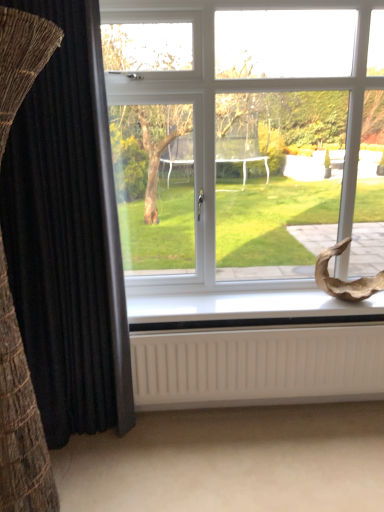
Describe the element at coordinates (65, 239) in the screenshot. I see `black velvet curtain at left` at that location.

Find the location of `white plastic window at center`. white plastic window at center is located at coordinates (246, 152).

From the image's perspective, is black velvet curtain at left beneath white matte radiator at bottom?

Actually, black velvet curtain at left appears above white matte radiator at bottom in the image.

The image size is (384, 512). I want to click on curtain above the white matte radiator at bottom (from the image's perspective), so click(65, 239).

Can you confirm if black velvet curtain at left is shorter than white matte radiator at bottom?

In fact, black velvet curtain at left may be taller than white matte radiator at bottom.

Is black velvet curtain at left oriented away from white matte radiator at bottom?

No.

Choose the correct answer: Is white matte radiator at bottom inside white plastic window at center or outside it?

Result: white matte radiator at bottom is located beyond the bounds of white plastic window at center.

Between point (335, 335) and point (214, 298), which one is positioned in front?

The point (335, 335) is more forward.

Can you tell me how much white matte radiator at bottom and white plastic window at center differ in facing direction?

The angle between the facing direction of white matte radiator at bottom and the facing direction of white plastic window at center is 0.0586 degrees.

From a real-world perspective, is white matte radiator at bottom below white plastic window at center?

Correct, in the physical world, white matte radiator at bottom is lower than white plastic window at center.

From the image's perspective, would you say white plastic window sill at lower center is shown under white matte radiator at bottom?

No.

From a real-world perspective, which is physically below, white plastic window sill at lower center or white matte radiator at bottom?

In real-world perspective, white matte radiator at bottom is lower.

Is white plastic window sill at lower center in front of or behind white matte radiator at bottom in the image?

Clearly, white plastic window sill at lower center is behind white matte radiator at bottom.

Is white plastic window sill at lower center oriented towards white matte radiator at bottom?

No, white plastic window sill at lower center is not aimed at white matte radiator at bottom.

How different are the orientations of white plastic window sill at lower center and black velvet curtain at left in degrees?

0.00334 degrees.

Does white plastic window sill at lower center have a lesser width compared to black velvet curtain at left?

Incorrect, the width of white plastic window sill at lower center is not less than that of black velvet curtain at left.

Are white plastic window sill at lower center and black velvet curtain at left making contact?

No, white plastic window sill at lower center is not making contact with black velvet curtain at left.

Where is `window sill on the right of black velvet curtain at left`? window sill on the right of black velvet curtain at left is located at coordinates (247, 310).

Is white matte radiator at bottom oriented towards black velvet curtain at left?

No, white matte radiator at bottom is not aimed at black velvet curtain at left.

Is white matte radiator at bottom to the right of black velvet curtain at left from the viewer's perspective?

Yes, white matte radiator at bottom is to the right of black velvet curtain at left.

Which of these two, white matte radiator at bottom or black velvet curtain at left, is wider?

black velvet curtain at left is wider.

From the image's perspective, is white matte radiator at bottom above or below black velvet curtain at left?

Based on their image positions, white matte radiator at bottom is located beneath black velvet curtain at left.

Where is `window above the black velvet curtain at left (from the image's perspective)`? window above the black velvet curtain at left (from the image's perspective) is located at coordinates (246, 152).

Is white plastic window at center beside black velvet curtain at left?

white plastic window at center is not next to black velvet curtain at left, and they're not touching.

From a real-world perspective, is white plastic window at center physically above black velvet curtain at left?

Yes, from a real-world perspective, white plastic window at center is over black velvet curtain at left

From the image's perspective, which is below, white plastic window at center or black velvet curtain at left?

From the image's view, black velvet curtain at left is below.

Is white matte radiator at bottom taller than white plastic window sill at lower center?

Yes, white matte radiator at bottom is taller than white plastic window sill at lower center.

Is the depth of white matte radiator at bottom less than that of white plastic window sill at lower center?

Yes, the depth of white matte radiator at bottom is less than that of white plastic window sill at lower center.

Does white matte radiator at bottom have a lesser width compared to white plastic window sill at lower center?

Yes.

Considering the relative sizes of white matte radiator at bottom and white plastic window sill at lower center in the image provided, is white matte radiator at bottom smaller than white plastic window sill at lower center?

No.

Locate an element on the screen. The height and width of the screenshot is (512, 384). curtain that is above the white matte radiator at bottom (from the image's perspective) is located at coordinates (65, 239).

Where is `radiator that appears below the white plastic window at center (from the image's perspective)`? The height and width of the screenshot is (512, 384). radiator that appears below the white plastic window at center (from the image's perspective) is located at coordinates (257, 365).

Based on their spatial positions, is white plastic window sill at lower center or black velvet curtain at left further from white matte radiator at bottom?

The object further to white matte radiator at bottom is black velvet curtain at left.

Estimate the real-world distances between objects in this image. Which object is closer to black velvet curtain at left, white matte radiator at bottom or white plastic window at center?

white matte radiator at bottom.

Based on their spatial positions, is black velvet curtain at left or white plastic window at center closer to white matte radiator at bottom?

black velvet curtain at left is positioned closer to the anchor white matte radiator at bottom.

Looking at the image, which one is located closer to white matte radiator at bottom, white plastic window sill at lower center or white plastic window at center?

white plastic window sill at lower center.

Which object lies nearer to the anchor point white plastic window sill at lower center, black velvet curtain at left or white matte radiator at bottom?

Based on the image, white matte radiator at bottom appears to be nearer to white plastic window sill at lower center.

Based on their spatial positions, is white plastic window at center or white matte radiator at bottom further from black velvet curtain at left?

white plastic window at center lies further to black velvet curtain at left than the other object.

Which object lies nearer to the anchor point black velvet curtain at left, white plastic window at center or white plastic window sill at lower center?

white plastic window sill at lower center is positioned closer to the anchor black velvet curtain at left.

When comparing their distances from white plastic window sill at lower center, does white matte radiator at bottom or black velvet curtain at left seem further?

black velvet curtain at left lies further to white plastic window sill at lower center than the other object.

Find the location of a particular element. Image resolution: width=384 pixels, height=512 pixels. window sill that lies between white plastic window at center and white matte radiator at bottom from top to bottom is located at coordinates (247, 310).

Identify the location of window between black velvet curtain at left and white plastic window sill at lower center from left to right. The width and height of the screenshot is (384, 512). (246, 152).

Find the location of a particular element. radiator between black velvet curtain at left and white plastic window at center from left to right is located at coordinates (257, 365).

The height and width of the screenshot is (512, 384). In order to click on radiator situated between black velvet curtain at left and white plastic window sill at lower center from left to right in this screenshot , I will do `click(257, 365)`.